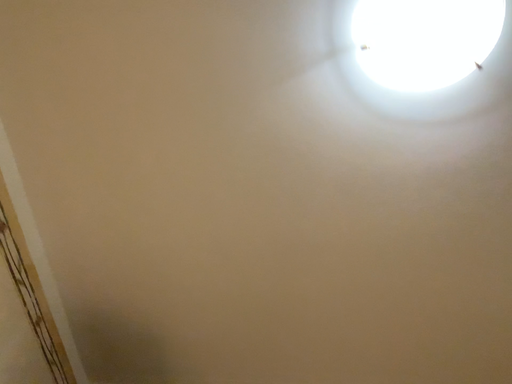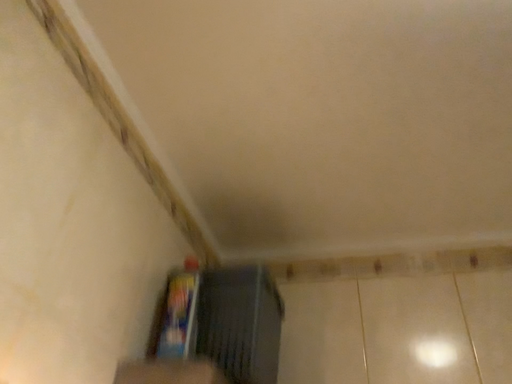
Question: Which way did the camera rotate in the video?

Choices:
 (A) rotated left
 (B) rotated right

Answer: (A)